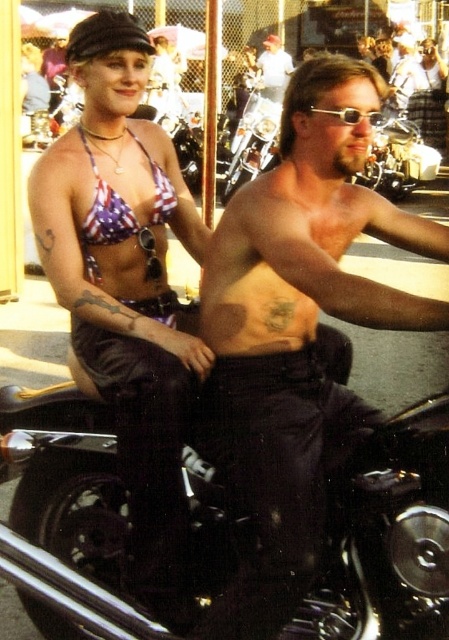
Question: Does american flag bikini top at left appear on the right side of american flag fabric bikini top at upper left?

Choices:
 (A) no
 (B) yes

Answer: (B)

Question: Does american flag bikini top at left have a smaller size compared to smooth white shirt at center?

Choices:
 (A) yes
 (B) no

Answer: (A)

Question: Which point is farther to the camera?

Choices:
 (A) american flag fabric bikini top at upper left
 (B) american flag bikini top at left
 (C) sunglasses at center

Answer: (A)

Question: Can you confirm if shiny black motorcycle at center is smaller than american flag fabric bikini top at upper left?

Choices:
 (A) no
 (B) yes

Answer: (A)

Question: Which object appears closest to the camera in this image?

Choices:
 (A) american flag bikini top at left
 (B) sunglasses at center

Answer: (B)

Question: Which point is farther to the camera?

Choices:
 (A) american flag bikini top at left
 (B) american flag fabric bikini top at upper left
 (C) smooth white shirt at center

Answer: (C)